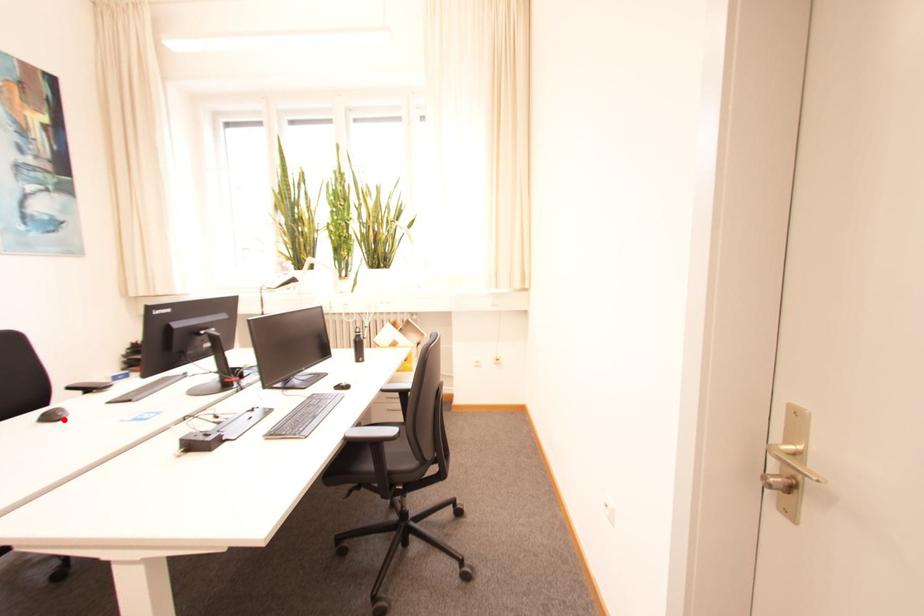
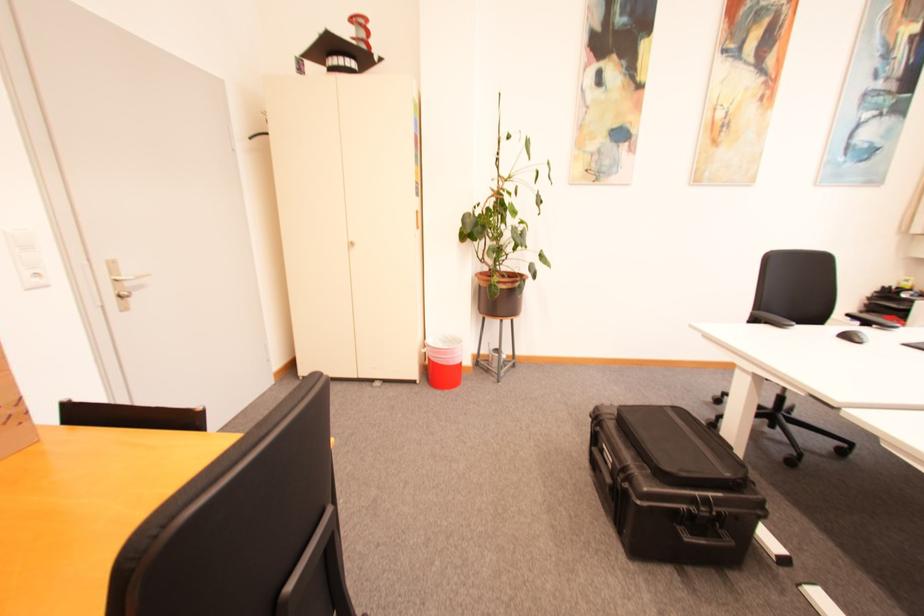
The point at the highlighted location is marked in the first image. Where is the corresponding point in the second image?

(865, 342)